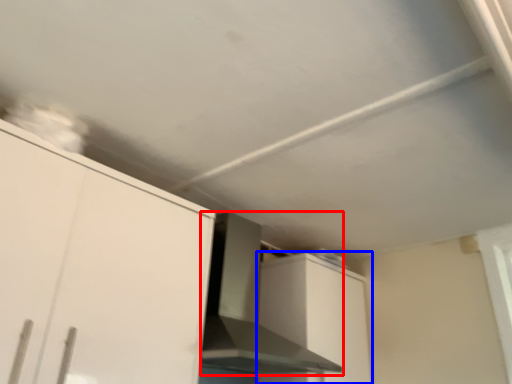
Question: Among these objects, which one is nearest to the camera, vent (highlighted by a red box) or cabinetry (highlighted by a blue box)?

Choices:
 (A) vent
 (B) cabinetry

Answer: (A)